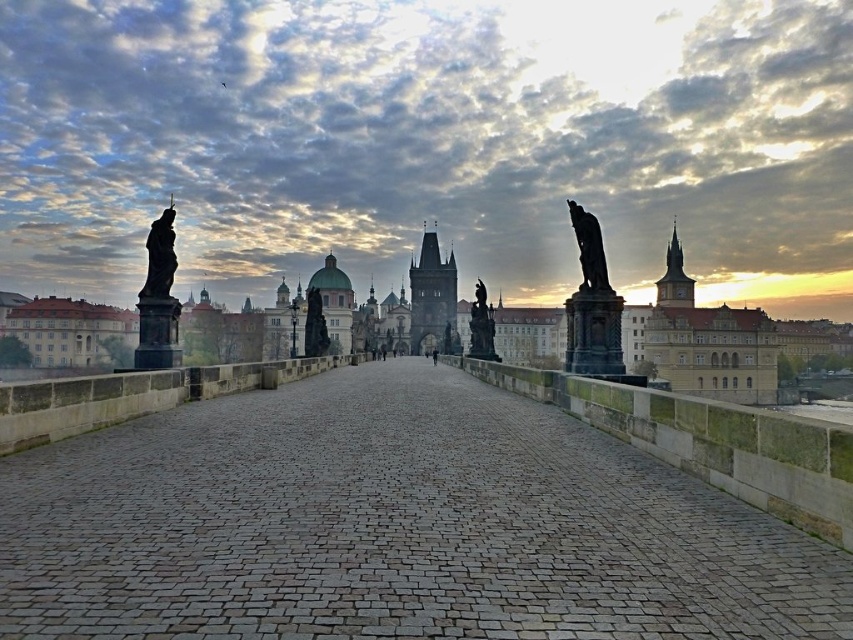
You are standing at the point marked by the coordinates point (392, 525) on Charles Bridge in Prague. Looking towards the Prague Castle spires in the background, which direction should you walk to stay on the gray cobblestone path at center?

The gray cobblestone path at center is represented by point (392, 525), so you should walk straight ahead along the path marked by this point to stay on the gray cobblestone path at center while facing the Prague Castle spires in the background.

You are an art student preparing to sketch the statues on Charles Bridge. You have a small sketchbook that can only accommodate details of statues up to 1 meter in width. Which statue between the polished bronze statue at right and the black stone statue at center should you choose to sketch to ensure it fits in your sketchbook?

The black stone statue at center has a smaller width compared to the polished bronze statue at right, so it would fit better in your 1 meter width sketchbook.